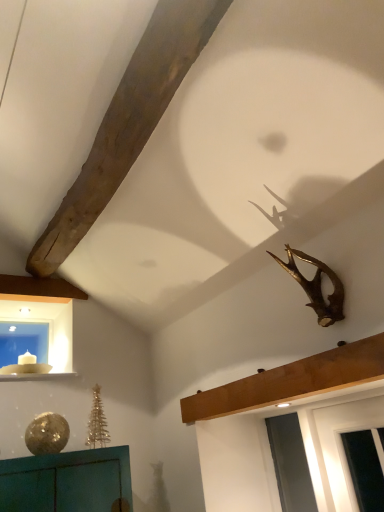
What do you see at coordinates (23, 342) in the screenshot? I see `blue glass window at lower left` at bounding box center [23, 342].

The height and width of the screenshot is (512, 384). Describe the element at coordinates (316, 286) in the screenshot. I see `gold metallic antlers at upper right` at that location.

What are the coordinates of `white glossy window sill at lower left` in the screenshot? It's located at (36, 376).

Locate an element on the screen. This screenshot has height=512, width=384. animal that appears in front of the white glossy window sill at lower left is located at coordinates [316, 286].

Is white glossy window sill at lower left inside the boundaries of gold metallic antlers at upper right, or outside?

white glossy window sill at lower left lies outside gold metallic antlers at upper right.

Does white glossy window sill at lower left have a lesser height compared to gold metallic antlers at upper right?

Yes.

From the image's perspective, would you say white glossy window sill at lower left is shown under gold metallic antlers at upper right?

Yes, from the image's perspective, white glossy window sill at lower left is beneath gold metallic antlers at upper right.

Identify the location of window on the left of gold metallic antlers at upper right. (23, 342).

From the image's perspective, is gold metallic antlers at upper right above blue glass window at lower left?

Correct, gold metallic antlers at upper right appears higher than blue glass window at lower left in the image.

Considering their positions, is gold metallic antlers at upper right located in front of or behind blue glass window at lower left?

gold metallic antlers at upper right is in front of blue glass window at lower left.

Which object is thinner, gold metallic antlers at upper right or blue glass window at lower left?

blue glass window at lower left.

Is white glossy window sill at lower left taller or shorter than wooden beam at upper center?

white glossy window sill at lower left is shorter than wooden beam at upper center.

Is wooden beam at upper center completely or partially inside white glossy window sill at lower left?

Actually, wooden beam at upper center is outside white glossy window sill at lower left.

From the picture: Is white glossy window sill at lower left facing towards wooden beam at upper center?

No, white glossy window sill at lower left is not facing towards wooden beam at upper center.

Is point (77, 374) behind point (288, 384)?

Yes, point (77, 374) is behind point (288, 384).

Is point (21, 334) closer to camera compared to point (286, 375)?

No, (21, 334) is further to viewer.

Would you say blue glass window at lower left is outside wooden beam at upper center?

blue glass window at lower left lies outside wooden beam at upper center's area.

Is blue glass window at lower left facing away from wooden beam at upper center?

No, blue glass window at lower left is not facing the opposite direction of wooden beam at upper center.

Is white glossy window sill at lower left at the right side of blue glass window at lower left?

Yes, white glossy window sill at lower left is to the right of blue glass window at lower left.

How many degrees apart are the facing directions of white glossy window sill at lower left and blue glass window at lower left?

They differ by 0.0134 degrees in their facing directions.

Between point (56, 378) and point (47, 349), which one is positioned in front?

The point (56, 378) is closer.

From the image's perspective, which is below, white glossy window sill at lower left or blue glass window at lower left?

white glossy window sill at lower left.

Is the position of wooden beam at upper center less distant than that of white glossy window sill at lower left?

Yes.

Considering the sizes of objects wooden beam at upper center and white glossy window sill at lower left in the image provided, who is thinner, wooden beam at upper center or white glossy window sill at lower left?

Thinner between the two is wooden beam at upper center.

Is point (352, 358) closer or farther from the camera than point (71, 373)?

Point (352, 358) appears to be closer to the viewer than point (71, 373).

Is gold metallic antlers at upper right oriented towards white glossy window sill at lower left?

No, gold metallic antlers at upper right is not turned towards white glossy window sill at lower left.

Is gold metallic antlers at upper right far away from white glossy window sill at lower left?

Absolutely, gold metallic antlers at upper right is distant from white glossy window sill at lower left.

From the picture: Considering the sizes of objects gold metallic antlers at upper right and white glossy window sill at lower left in the image provided, who is bigger, gold metallic antlers at upper right or white glossy window sill at lower left?

gold metallic antlers at upper right is bigger.

In order to click on animal directly beneath the white glossy window sill at lower left (from a real-world perspective) in this screenshot , I will do `click(316, 286)`.

Where is `animal located above the blue glass window at lower left (from the image's perspective)`? animal located above the blue glass window at lower left (from the image's perspective) is located at coordinates [316, 286].

From the image, which object appears to be nearer to gold metallic antlers at upper right, white glossy window sill at lower left or blue glass window at lower left?

white glossy window sill at lower left.

Which object lies nearer to the anchor point wooden beam at upper center, blue glass window at lower left or gold metallic antlers at upper right?

gold metallic antlers at upper right.

From the picture: Which object lies nearer to the anchor point blue glass window at lower left, white glossy window sill at lower left or wooden beam at upper center?

white glossy window sill at lower left is positioned closer to the anchor blue glass window at lower left.

When comparing their distances from blue glass window at lower left, does gold metallic antlers at upper right or white glossy window sill at lower left seem further?

gold metallic antlers at upper right.

From the image, which object appears to be farther from wooden beam at upper center, white glossy window sill at lower left or gold metallic antlers at upper right?

white glossy window sill at lower left is positioned further to the anchor wooden beam at upper center.

Based on their spatial positions, is gold metallic antlers at upper right or white glossy window sill at lower left further from wooden beam at upper center?

white glossy window sill at lower left is further to wooden beam at upper center.

Considering their positions, is blue glass window at lower left positioned further to gold metallic antlers at upper right than white glossy window sill at lower left?

blue glass window at lower left is positioned further to the anchor gold metallic antlers at upper right.

Looking at this image, estimate the real-world distances between objects in this image. Which object is closer to blue glass window at lower left, wooden beam at upper center or white glossy window sill at lower left?

white glossy window sill at lower left is positioned closer to the anchor blue glass window at lower left.

Find the location of a particular element. Image resolution: width=384 pixels, height=512 pixels. shelf situated between white glossy window sill at lower left and gold metallic antlers at upper right from left to right is located at coordinates (291, 381).

Where is `window sill between blue glass window at lower left and wooden beam at upper center from left to right`? The width and height of the screenshot is (384, 512). window sill between blue glass window at lower left and wooden beam at upper center from left to right is located at coordinates (36, 376).

The height and width of the screenshot is (512, 384). Find the location of `window sill between blue glass window at lower left and gold metallic antlers at upper right in the horizontal direction`. window sill between blue glass window at lower left and gold metallic antlers at upper right in the horizontal direction is located at coordinates (36, 376).

The width and height of the screenshot is (384, 512). Find the location of `shelf between blue glass window at lower left and gold metallic antlers at upper right in the horizontal direction`. shelf between blue glass window at lower left and gold metallic antlers at upper right in the horizontal direction is located at coordinates (x=291, y=381).